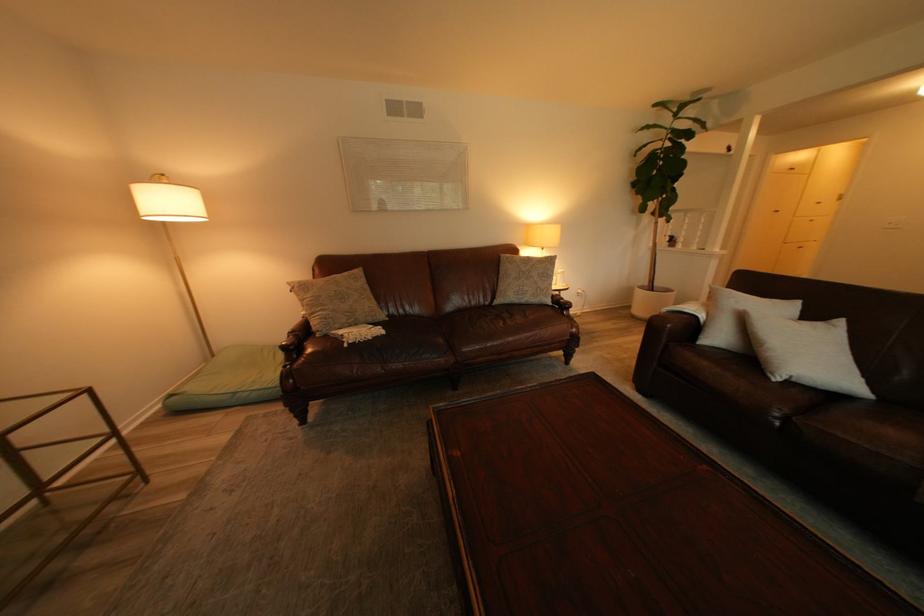
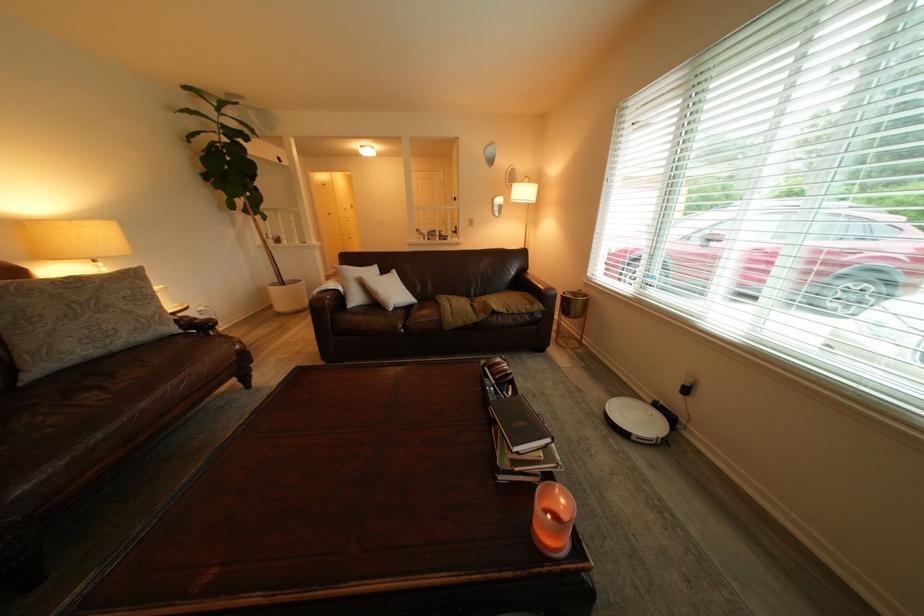
In the second image, find the point that corresponds to (x=700, y=309) in the first image.

(343, 286)